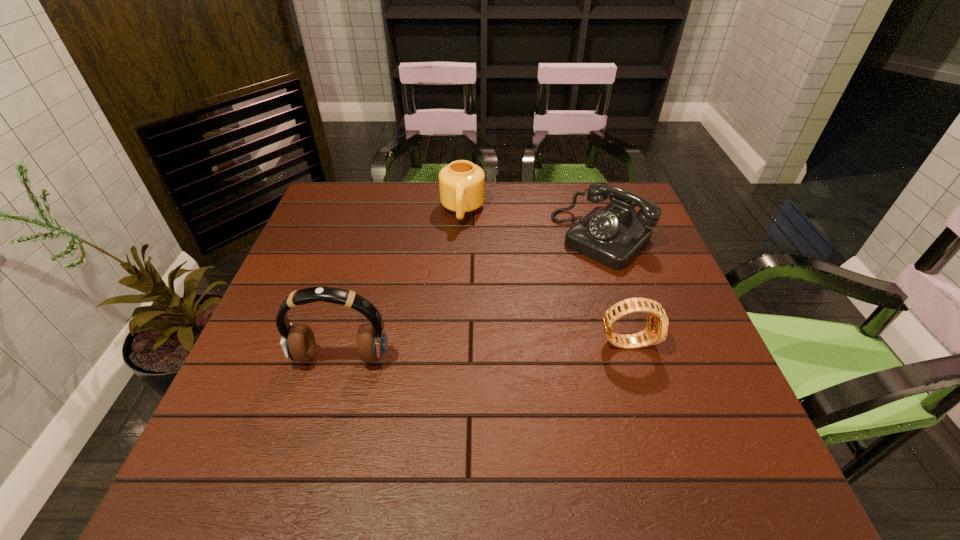
This screenshot has width=960, height=540. What are the coordinates of `vacant space at the left edge` in the screenshot? It's located at (312, 373).

At what (x,y) coordinates should I click in order to perform the action: click on vacant space at the right edge of the desktop. Please return your answer as a coordinate pair (x, y). Image resolution: width=960 pixels, height=540 pixels. Looking at the image, I should click on (636, 286).

This screenshot has height=540, width=960. In the image, there is a desktop. Find the location of `vacant area at the near right corner`. vacant area at the near right corner is located at coordinates (716, 417).

I want to click on free space between the telephone and the watch, so click(614, 289).

Identify the location of empty space that is in between the headset and the third object from right to left. (402, 284).

Where is `free space that is in between the headset and the watch`? free space that is in between the headset and the watch is located at coordinates (484, 350).

Identify the location of free space between the mug and the telephone. Image resolution: width=960 pixels, height=540 pixels. (532, 224).

This screenshot has width=960, height=540. What are the coordinates of `vacant space in between the mug and the watch` in the screenshot? It's located at (544, 275).

The image size is (960, 540). Identify the location of empty space between the tallest object and the telephone. (471, 298).

I want to click on free spot between the headset and the telephone, so click(471, 298).